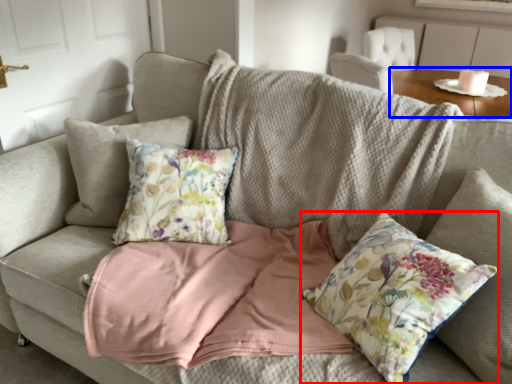
Question: Which object is further to the camera taking this photo, pillow (highlighted by a red box) or table (highlighted by a blue box)?

Choices:
 (A) pillow
 (B) table

Answer: (B)